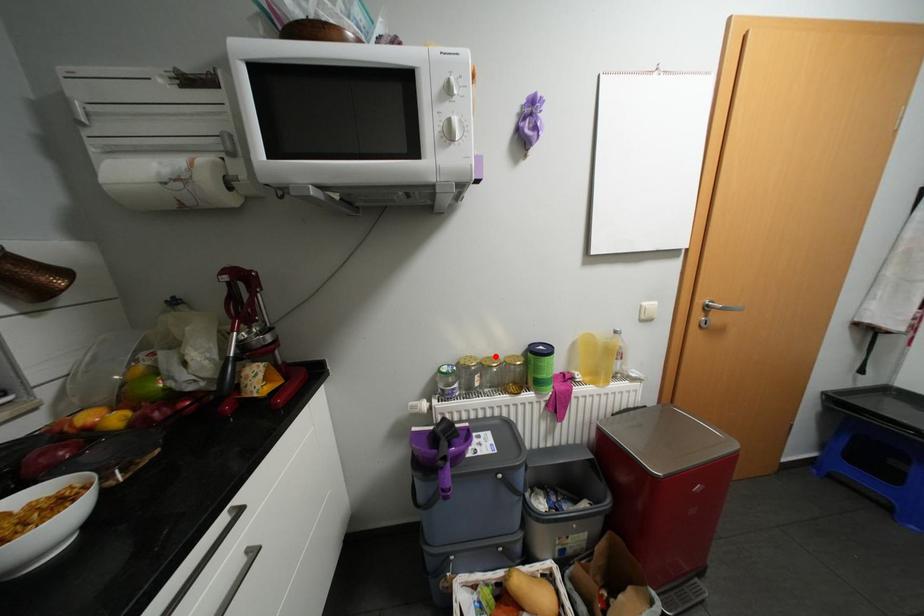
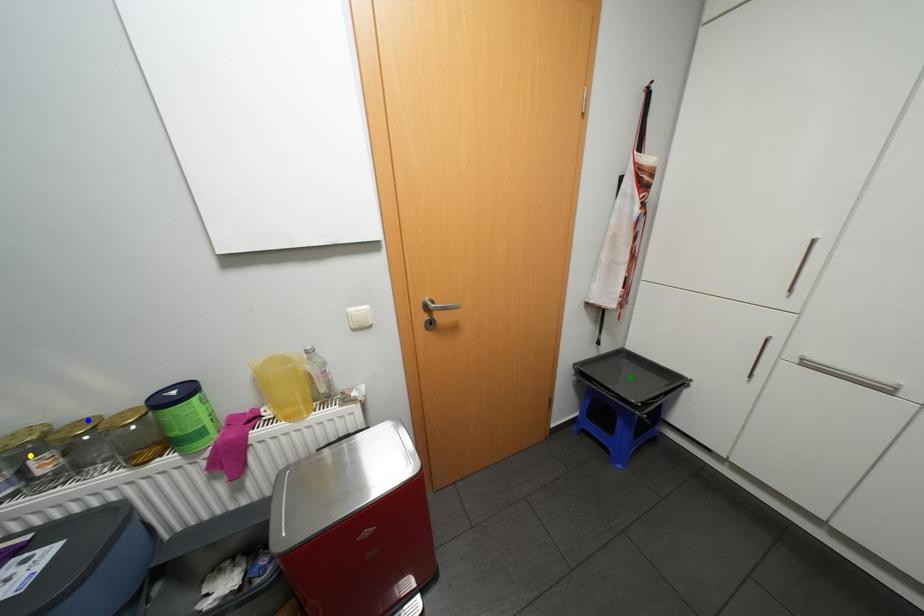
Question: I am providing you with two images of the same scene from different viewpoints. A red point is marked on the first image. You are given multiple points on the second image. Which spot in image 2 lines up with the point in image 1?

Choices:
 (A) yellow point
 (B) green point
 (C) blue point

Answer: (C)